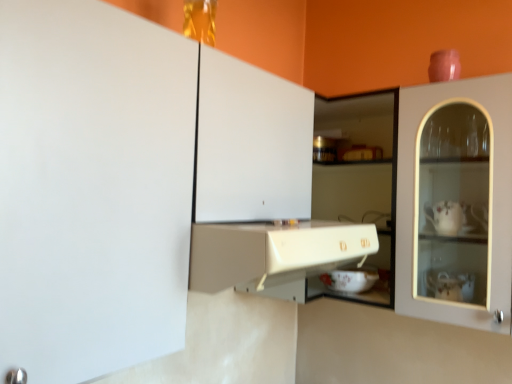
Question: Is the position of white glossy bowl at center less distant than that of white matte cabinet at upper left, the second cabinetry in the bottom-to-top sequence?

Choices:
 (A) no
 (B) yes

Answer: (A)

Question: Is white glossy bowl at center positioned beyond the bounds of white matte cabinet at upper left, the second cabinetry in the bottom-to-top sequence?

Choices:
 (A) yes
 (B) no

Answer: (A)

Question: Is white glossy bowl at center taller than white matte cabinet at upper left, the second cabinetry in the bottom-to-top sequence?

Choices:
 (A) no
 (B) yes

Answer: (A)

Question: Can you confirm if white glossy bowl at center is smaller than white matte cabinet at upper left, acting as the 1th cabinetry starting from the top?

Choices:
 (A) no
 (B) yes

Answer: (B)

Question: Is white glossy bowl at center facing towards white matte cabinet at upper left, acting as the 1th cabinetry starting from the top?

Choices:
 (A) yes
 (B) no

Answer: (B)

Question: Is the depth of white glossy bowl at center greater than that of white matte cabinet at upper left, the second cabinetry in the bottom-to-top sequence?

Choices:
 (A) yes
 (B) no

Answer: (A)

Question: From a real-world perspective, is matte white cabinet at center, arranged as the first cabinetry when ordered from the bottom, positioned under white glossy bowl at center based on gravity?

Choices:
 (A) no
 (B) yes

Answer: (A)

Question: Can white glossy bowl at center be found inside matte white cabinet at center, arranged as the first cabinetry when ordered from the bottom?

Choices:
 (A) yes
 (B) no

Answer: (B)

Question: Does matte white cabinet at center, placed as the 2th cabinetry when sorted from top to bottom, lie in front of white glossy bowl at center?

Choices:
 (A) no
 (B) yes

Answer: (B)

Question: Is matte white cabinet at center, arranged as the first cabinetry when ordered from the bottom, smaller than white glossy bowl at center?

Choices:
 (A) no
 (B) yes

Answer: (A)

Question: Is white glossy bowl at center at the back of matte white cabinet at center, arranged as the first cabinetry when ordered from the bottom?

Choices:
 (A) yes
 (B) no

Answer: (B)

Question: Is matte white cabinet at center, placed as the 2th cabinetry when sorted from top to bottom, not inside white glossy bowl at center?

Choices:
 (A) yes
 (B) no

Answer: (A)

Question: Is white matte cabinet at upper left, acting as the 1th cabinetry starting from the top, looking in the opposite direction of white glossy bowl at center?

Choices:
 (A) yes
 (B) no

Answer: (B)